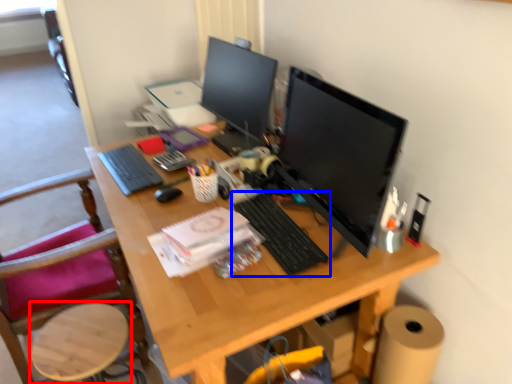
Question: Which object is closer to the camera taking this photo, round table (highlighted by a red box) or computer keyboard (highlighted by a blue box)?

Choices:
 (A) round table
 (B) computer keyboard

Answer: (B)